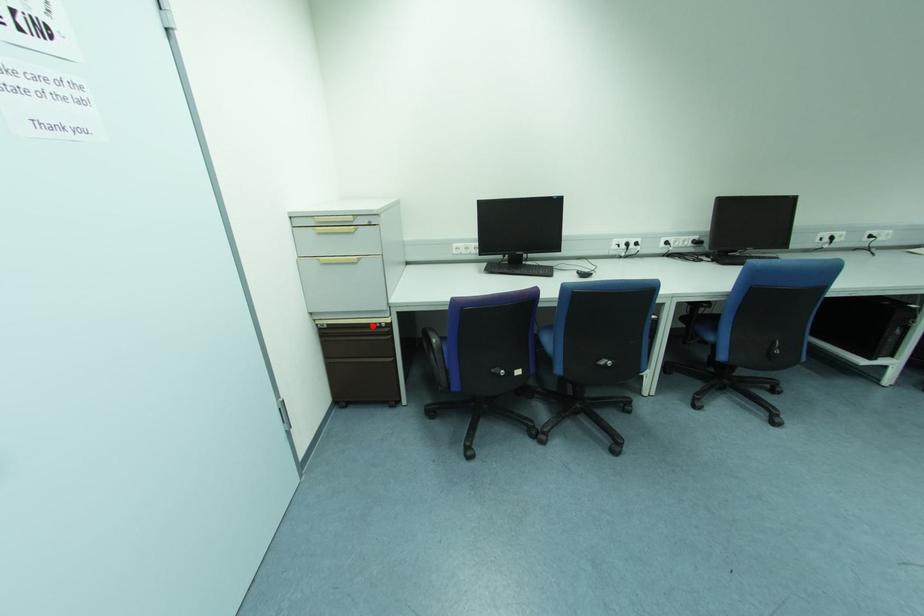
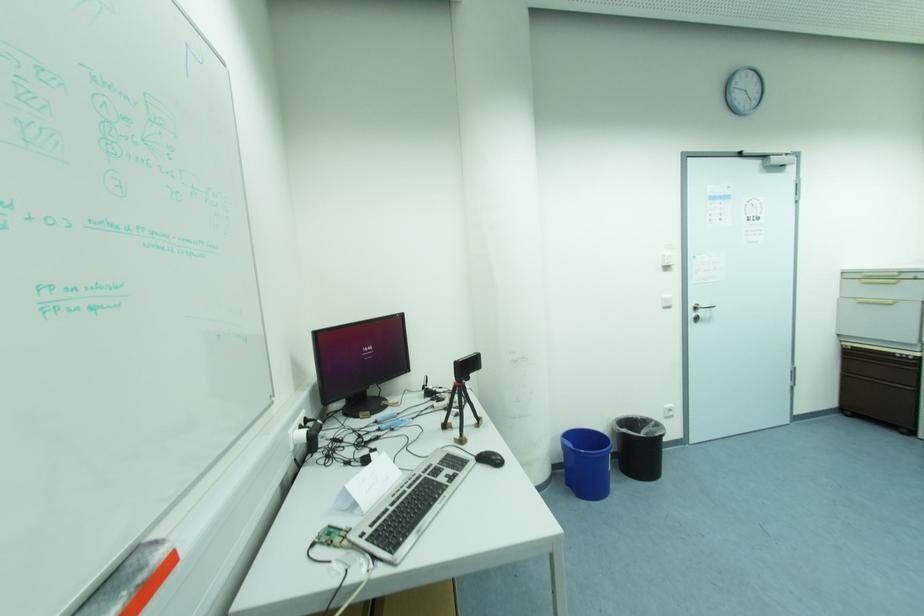
Question: I am providing you with two images of the same scene from different viewpoints. Image1 has a red point marked. In image2, the corresponding 3D location appears at what relative position? Reply with the corresponding letter.

Choices:
 (A) Closer
 (B) Farther

Answer: (B)